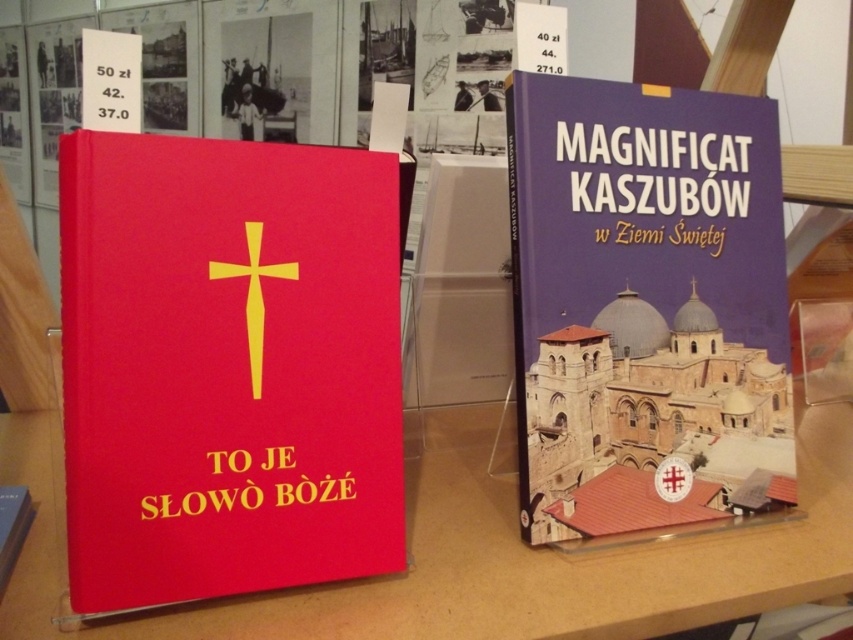
You are a librarian organizing books on a shelf. You need to place a new book exactly at the coordinates given in the scene. Where should you place the new book if you want it to be at the same position as the matte red book at center?

You should place the new book at the coordinates point (227, 365), which is the same location as the matte red book at center.